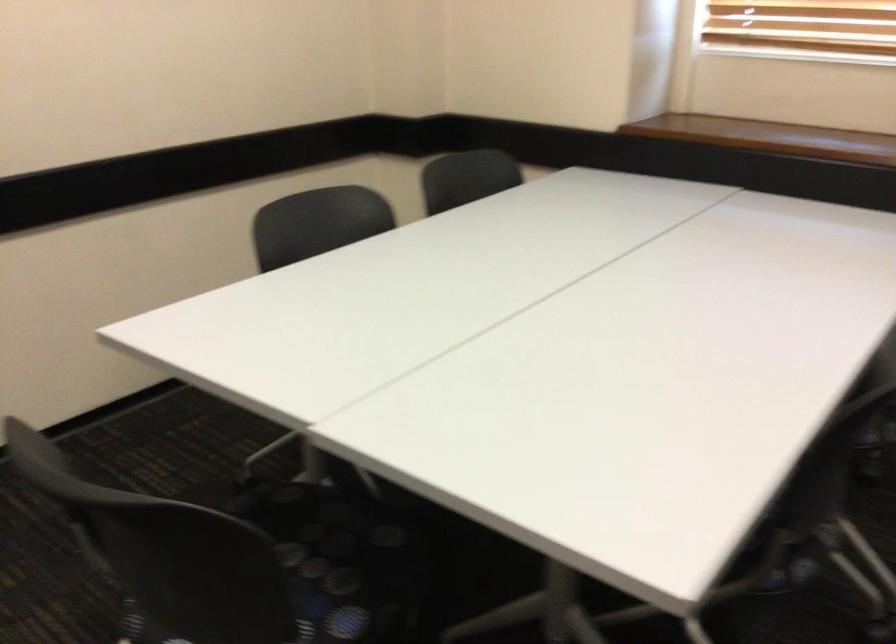
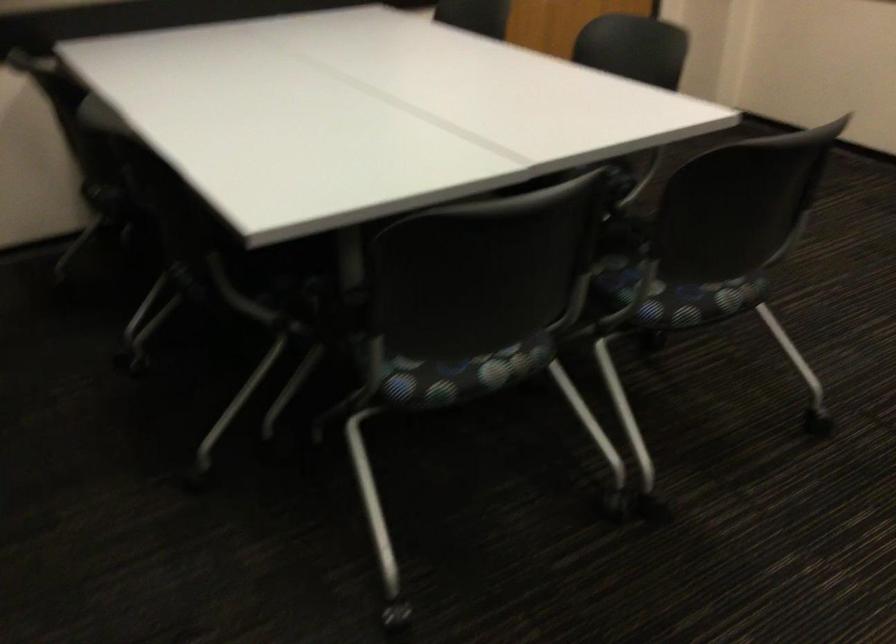
How did the camera likely rotate?

The camera rotated toward left-down.